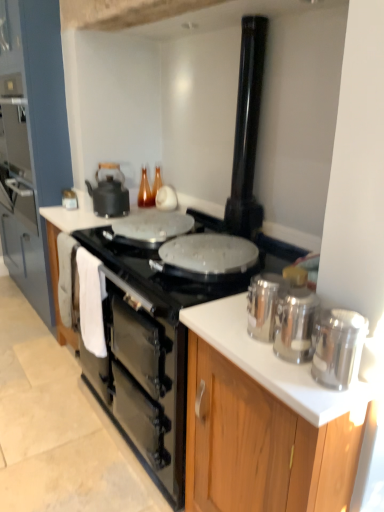
In order to click on free space behind silver metallic canisters at right, positioned as the third kitchen appliance in right-to-left order in this screenshot , I will do `click(230, 314)`.